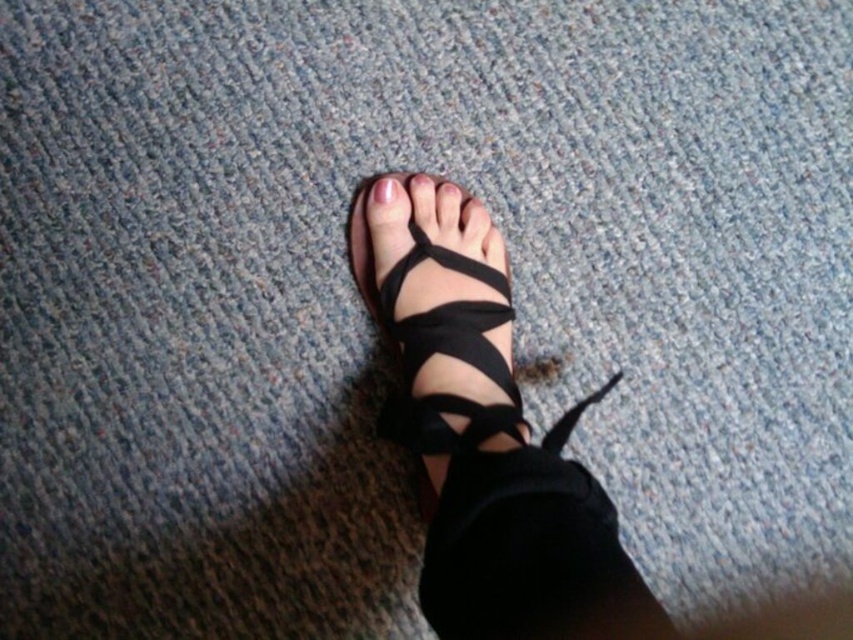
Can you confirm if black leather sandals at center is positioned below pink matte nail at center?

Yes, black leather sandals at center is below pink matte nail at center.

Does point (527, 481) lie in front of point (381, 188)?

Yes, point (527, 481) is in front of point (381, 188).

The width and height of the screenshot is (853, 640). I want to click on black leather sandals at center, so [x=485, y=440].

Is black leather sandals at center shorter than matte black toe at center?

No, black leather sandals at center is not shorter than matte black toe at center.

Is black leather sandals at center behind matte black toe at center?

No, it is in front of matte black toe at center.

Is point (529, 564) positioned before point (474, 212)?

Yes, point (529, 564) is closer to viewer.

Where is `black leather sandals at center`? black leather sandals at center is located at coordinates (485, 440).

Consider the image. Who is positioned more to the left, matte black toe at center or pink matte nail at center?

Positioned to the left is pink matte nail at center.

Locate an element on the screen. matte black toe at center is located at coordinates (473, 218).